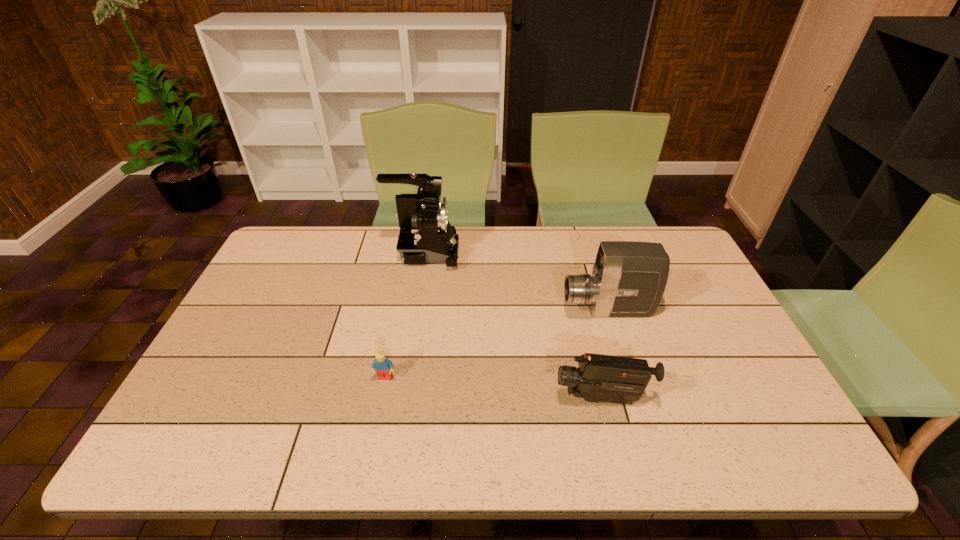
You are a GUI agent. You are given a task and a screenshot of the screen. Output one action in this format:
    pyautogui.click(x=<x>, y=<y>)
    Task: Click on the farthest object
    This screenshot has height=540, width=960.
    Given the screenshot: What is the action you would take?
    pyautogui.click(x=426, y=236)

Locate an element on the screen. the tallest camcorder is located at coordinates (426, 236).

Where is `the second farthest object`? the second farthest object is located at coordinates 629,278.

Locate an element on the screen. This screenshot has height=540, width=960. the second shortest camcorder is located at coordinates (629, 278).

Where is `the nearest object`? the nearest object is located at coordinates (599, 378).

You are a GUI agent. You are given a task and a screenshot of the screen. Output one action in this format:
    pyautogui.click(x=<x>, y=<y>)
    Task: Click on the nearest camcorder
    
    Given the screenshot: What is the action you would take?
    pyautogui.click(x=599, y=378)

Where is `the shortest object`? The width and height of the screenshot is (960, 540). the shortest object is located at coordinates (382, 365).

Locate an element on the screen. The image size is (960, 540). Lego is located at coordinates (382, 365).

Image resolution: width=960 pixels, height=540 pixels. I want to click on free space located on the lens mount of the leftmost camcorder, so click(x=487, y=253).

Identify the location of blank space located 0.100m at the front of the third shortest object, highlighting the lens. The image size is (960, 540). (528, 310).